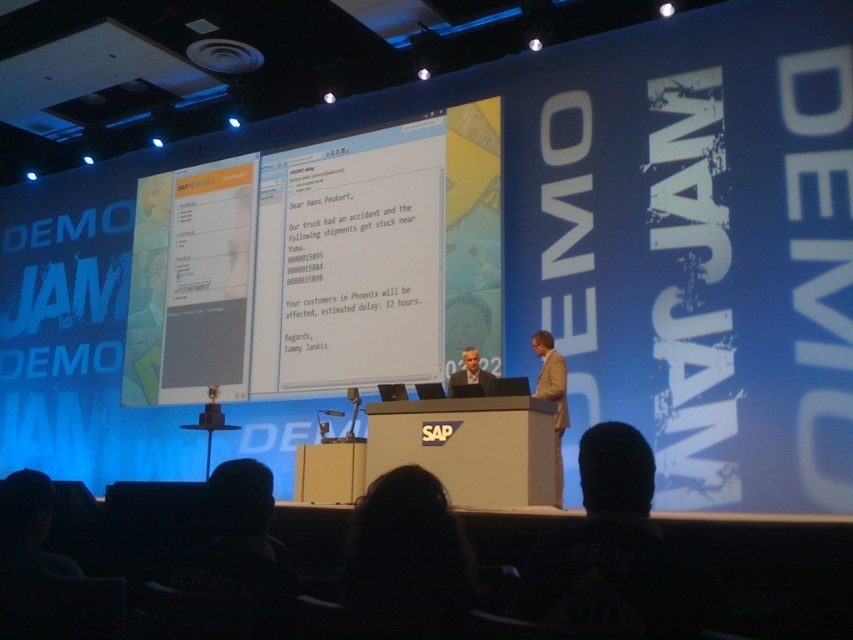
You are an event organizer at the Demo Jam. You need to arrange seating for two presenters wearing the tan fabric suit at center and the light brown suit at center. Since the audience will be watching from the front, which presenter should sit closer to the back of the stage to ensure both are visible?

The light brown suit at center should sit closer to the back of the stage because the tan fabric suit at center is taller. This way, the taller presenter can be positioned in front to avoid blocking the shorter one from the audience view.

You are an attendee at the Demo Jam event. You notice two presenters wearing suits at the SAP podium. One is wearing a tan fabric suit at center and the other a light brown suit at center. Which presenter is standing closer to the front of the stage?

The tan fabric suit at center is closer to the viewer than the light brown suit at center, so the presenter in the tan fabric suit at center is standing closer to the front of the stage.